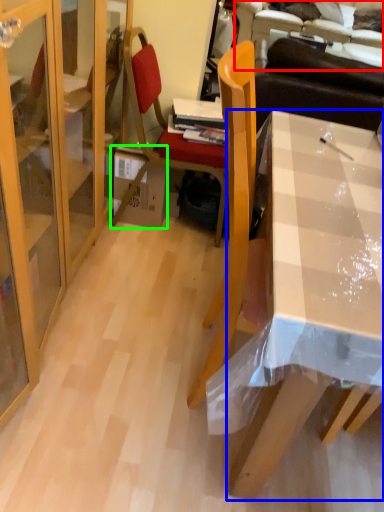
Question: Which object is the farthest from couch (highlighted by a red box)? Choose among these: desk (highlighted by a blue box) or box (highlighted by a green box).

Choices:
 (A) desk
 (B) box

Answer: (A)